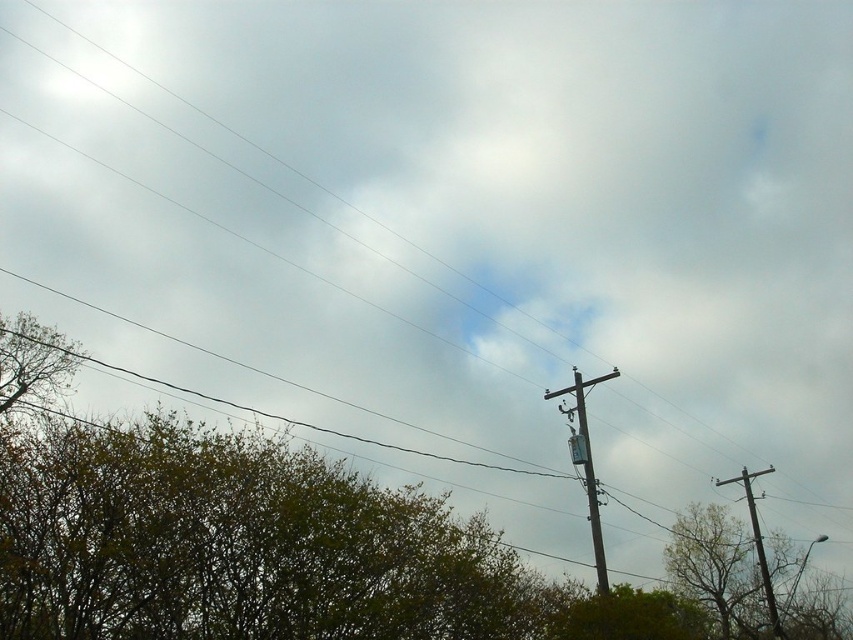
Is point (697, 596) more distant than point (758, 556)?

No, it is in front of (758, 556).

I want to click on green leafy tree at lower right, so click(715, 564).

In the scene shown: Does green leafy tree at lower center have a larger size compared to brown wooden telegraph pole at upper right?

Yes, green leafy tree at lower center is bigger than brown wooden telegraph pole at upper right.

Which is in front, point (611, 604) or point (762, 579)?

Point (611, 604) is in front.

Who is more distant from viewer, (569, 602) or (764, 580)?

Point (764, 580)

Locate an element on the screen. This screenshot has height=640, width=853. green leafy tree at lower center is located at coordinates (630, 616).

In the scene shown: Measure the distance between point (612,604) and camera.

Point (612,604) and camera are 26.36 meters apart.

Does green leafy tree at lower center appear over gray metallic telegraph pole at center-right?

Actually, green leafy tree at lower center is below gray metallic telegraph pole at center-right.

Which is in front, point (703, 637) or point (578, 381)?

Positioned in front is point (578, 381).

Find the location of a particular element. green leafy tree at lower center is located at coordinates tap(630, 616).